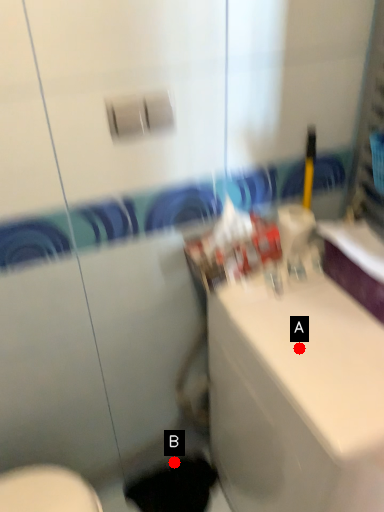
Question: Two points are circled on the image, labeled by A and B beside each circle. Which point appears farthest from the camera in this image?

Choices:
 (A) A is further
 (B) B is further

Answer: (B)